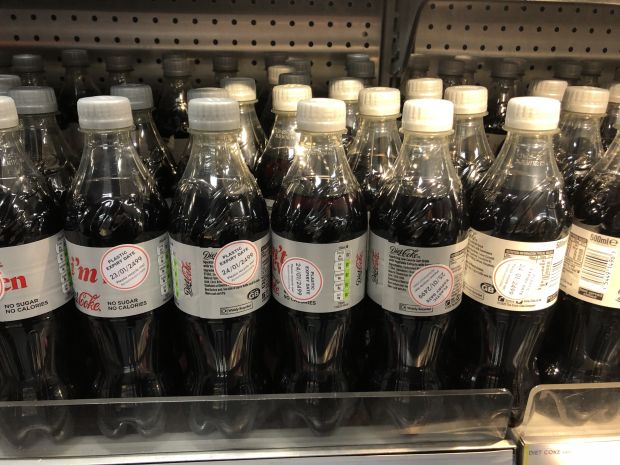
Identify the location of rack. (400, 31).